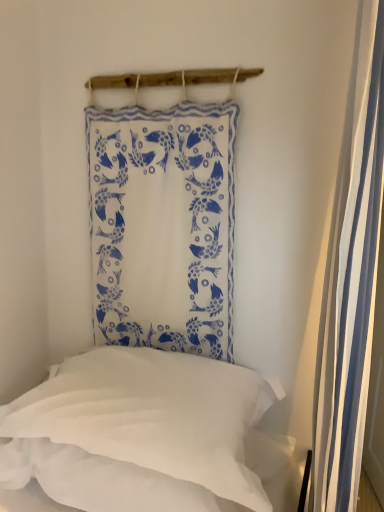
Question: Is white fabric with blue fish pattern at upper center positioned behind white soft pillow at lower left?

Choices:
 (A) no
 (B) yes

Answer: (B)

Question: Could you tell me if white fabric with blue fish pattern at upper center is turned towards white soft pillow at lower left?

Choices:
 (A) yes
 (B) no

Answer: (B)

Question: Is white fabric with blue fish pattern at upper center far from white soft pillow at lower left?

Choices:
 (A) no
 (B) yes

Answer: (A)

Question: Can we say white fabric with blue fish pattern at upper center lies outside white soft pillow at lower left?

Choices:
 (A) no
 (B) yes

Answer: (B)

Question: Considering the relative positions of white fabric with blue fish pattern at upper center and white soft pillow at lower left in the image provided, is white fabric with blue fish pattern at upper center to the left of white soft pillow at lower left from the viewer's perspective?

Choices:
 (A) yes
 (B) no

Answer: (B)

Question: From a real-world perspective, is white fabric with blue fish pattern at upper center below white soft pillow at lower left?

Choices:
 (A) yes
 (B) no

Answer: (B)

Question: From a real-world perspective, is white soft pillow at lower left physically below white fabric with blue fish pattern at upper center?

Choices:
 (A) no
 (B) yes

Answer: (B)

Question: Can we say white soft pillow at lower left lies outside white fabric with blue fish pattern at upper center?

Choices:
 (A) yes
 (B) no

Answer: (A)

Question: Does white soft pillow at lower left appear on the left side of white fabric with blue fish pattern at upper center?

Choices:
 (A) yes
 (B) no

Answer: (A)

Question: Does white soft pillow at lower left have a greater width compared to white fabric with blue fish pattern at upper center?

Choices:
 (A) yes
 (B) no

Answer: (A)

Question: From the image's perspective, does white soft pillow at lower left appear lower than white fabric with blue fish pattern at upper center?

Choices:
 (A) no
 (B) yes

Answer: (B)

Question: Could you tell me if white soft pillow at lower left is facing white fabric with blue fish pattern at upper center?

Choices:
 (A) no
 (B) yes

Answer: (A)

Question: Is white striped fabric at right taller than white fabric with blue fish pattern at upper center?

Choices:
 (A) no
 (B) yes

Answer: (B)